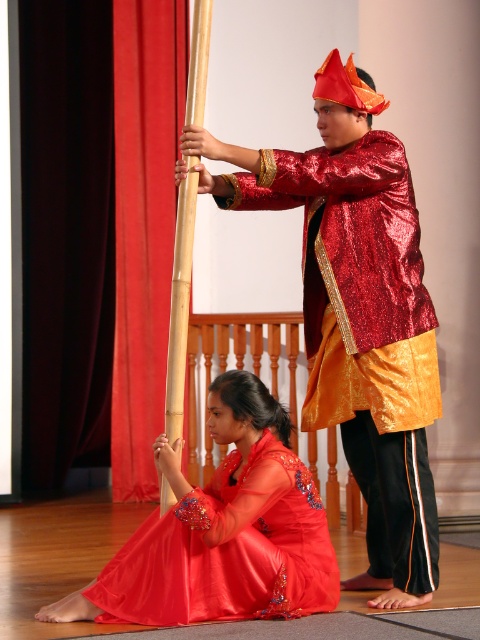
You are standing at the center of the stage and see the point marked at coordinates (x=365, y=333). Which object from the scene is this point located on?

The point marked at coordinates (x=365, y=333) is located on the shiny red robe at center.

You are a photographer at the back of the stage and want to capture both the shiny red robe at center and the satin red dress at lower center in a single photo. Which object should you focus on first to ensure both are in frame?

The shiny red robe at center is much taller than the satin red dress at lower center, so you should focus on the shiny red robe at center first to ensure both are in frame.